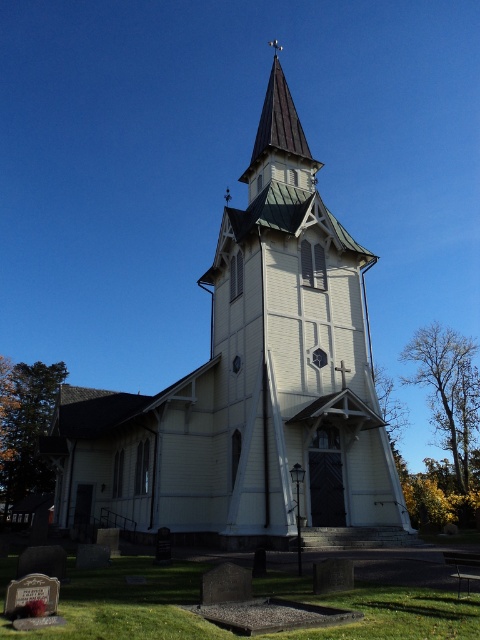
You are standing in front of the church and notice the white wood church at center and the shiny copper spire at upper center. Which object is located higher up in the image?

The shiny copper spire at upper center is higher up because it is positioned above the white wood church at center.

You are a photographer planning to capture the white wood church at center and the shiny copper spire at upper center in a single frame. Which object will occupy more horizontal space in the photo?

The white wood church at center will occupy more horizontal space in the photo since its width surpasses that of the shiny copper spire at upper center.